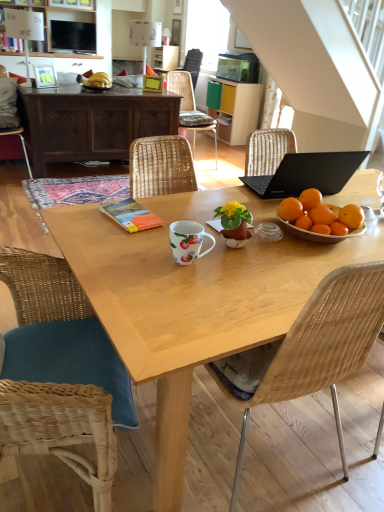
Measure the distance between wooden wicker chair at lower left, which is counted as the 2th chair, starting from the back, and camera.

wooden wicker chair at lower left, which is counted as the 2th chair, starting from the back, and camera are 12.10 feet apart from each other.

Describe the element at coordinates (11, 113) in the screenshot. I see `wooden wicker chair at lower left, which is counted as the 2th chair, starting from the back` at that location.

How much space does wooden picture frame at upper left, which ranks as the first picture frame in bottom-to-top order, occupy horizontally?

It is 4.42 inches.

How much space does dark wood cabinet at upper left, the first desk when ordered from top to bottom, occupy vertically?

It is 30.21 inches.

What do you see at coordinates (239, 109) in the screenshot? This screenshot has width=384, height=512. I see `matte wood cabinet at center, the first cabinetry in the bottom-to-top sequence` at bounding box center [239, 109].

The image size is (384, 512). Find the location of `wooden wicker chair at lower left, marked as the 1th chair in a left-to-right arrangement`. wooden wicker chair at lower left, marked as the 1th chair in a left-to-right arrangement is located at coordinates (11, 113).

Can you tell me how much wooden picture frame at upper left, which ranks as the first picture frame in bottom-to-top order, and matte wood cabinet at upper left, the first cabinetry from the left, differ in facing direction?

The facing directions of wooden picture frame at upper left, which ranks as the first picture frame in bottom-to-top order, and matte wood cabinet at upper left, the first cabinetry from the left, are 35.6 degrees apart.

From the image's perspective, is wooden picture frame at upper left, placed as the fourth picture frame when sorted from right to left, under matte wood cabinet at upper left, acting as the first cabinetry starting from the top?

Yes, from the image's perspective, wooden picture frame at upper left, placed as the fourth picture frame when sorted from right to left, is below matte wood cabinet at upper left, acting as the first cabinetry starting from the top.

Visually, is wooden picture frame at upper left, marked as the first picture frame in a front-to-back arrangement, positioned to the left or to the right of matte wood cabinet at upper left, the 2th cabinetry from the right?

Clearly, wooden picture frame at upper left, marked as the first picture frame in a front-to-back arrangement, is on the right of matte wood cabinet at upper left, the 2th cabinetry from the right, in the image.

Is wooden picture frame at upper left, the fourth picture frame from the top, completely or partially outside of matte wood cabinet at upper left, the first cabinetry from the left?

Yes.

Which is more to the left, wooden picture frame at upper center, arranged as the 2th picture frame when viewed from the back, or wooden woven chair at center, acting as the first chair starting from the back?

From the viewer's perspective, wooden picture frame at upper center, arranged as the 2th picture frame when viewed from the back, appears more on the left side.

Can you confirm if wooden picture frame at upper center, arranged as the 2th picture frame when viewed from the back, is smaller than wooden woven chair at center, which appears as the second chair when viewed from the right?

Correct, wooden picture frame at upper center, arranged as the 2th picture frame when viewed from the back, occupies less space than wooden woven chair at center, which appears as the second chair when viewed from the right.

From a real-world perspective, between wooden picture frame at upper center, the 4th picture frame viewed from the left, and wooden woven chair at center, which appears as the second chair when viewed from the right, who is vertically higher?

From a 3D spatial view, wooden picture frame at upper center, the 4th picture frame viewed from the left, is above.

Is wooden table at center, acting as the 1th desk starting from the bottom, situated inside matte black tv at upper left or outside?

wooden table at center, acting as the 1th desk starting from the bottom, cannot be found inside matte black tv at upper left.

Which is more to the left, wooden table at center, positioned as the 1th desk in front-to-back order, or matte black tv at upper left?

Positioned to the left is matte black tv at upper left.

Considering the sizes of wooden table at center, positioned as the 1th desk in front-to-back order, and matte black tv at upper left in the image, is wooden table at center, positioned as the 1th desk in front-to-back order, taller or shorter than matte black tv at upper left?

Considering their sizes, wooden table at center, positioned as the 1th desk in front-to-back order, has more height than matte black tv at upper left.

Could you tell me if wooden table at center, acting as the 2th desk starting from the top, is facing matte black tv at upper left?

Yes, wooden table at center, acting as the 2th desk starting from the top, is aimed at matte black tv at upper left.

Does point (146, 75) come closer to viewer compared to point (238, 85)?

Yes, it is in front of point (238, 85).

From a real-world perspective, between matte gold picture frame at center, arranged as the third picture frame when viewed from the right, and matte wood cabinet at center, the 2th cabinetry from the left, who is vertically higher?

matte gold picture frame at center, arranged as the third picture frame when viewed from the right.

Considering the positions of objects matte gold picture frame at center, the 2th picture frame when ordered from front to back, and matte wood cabinet at center, the 2th cabinetry positioned from the top, in the image provided, who is in front, matte gold picture frame at center, the 2th picture frame when ordered from front to back, or matte wood cabinet at center, the 2th cabinetry positioned from the top,?

Positioned in front is matte gold picture frame at center, the 2th picture frame when ordered from front to back.

Considering the relative sizes of matte gold picture frame at center, which appears as the second picture frame when viewed from the left, and matte wood cabinet at center, the first cabinetry in the bottom-to-top sequence, in the image provided, is matte gold picture frame at center, which appears as the second picture frame when viewed from the left, shorter than matte wood cabinet at center, the first cabinetry in the bottom-to-top sequence,?

Correct, matte gold picture frame at center, which appears as the second picture frame when viewed from the left, is not as tall as matte wood cabinet at center, the first cabinetry in the bottom-to-top sequence.

Who is shorter, wooden wicker chair at lower left, placed as the 3th chair when sorted from front to back, or wooden woven chair at center, acting as the first chair starting from the back?

wooden woven chair at center, acting as the first chair starting from the back, is shorter.

Does point (12, 135) come in front of point (192, 91)?

Yes, it is.

Is wooden wicker chair at lower left, marked as the fourth chair in a right-to-left arrangement, wider or thinner than wooden woven chair at center, which appears as the second chair when viewed from the right?

Considering their sizes, wooden wicker chair at lower left, marked as the fourth chair in a right-to-left arrangement, looks broader than wooden woven chair at center, which appears as the second chair when viewed from the right.

Is wooden wicker chair at lower left, which is counted as the 2th chair, starting from the back, in contact with wooden woven chair at center, acting as the fourth chair starting from the front?

wooden wicker chair at lower left, which is counted as the 2th chair, starting from the back, is not next to wooden woven chair at center, acting as the fourth chair starting from the front, and they're not touching.

Who is taller, wooden wicker chair at lower left, which is counted as the 2th chair, starting from the back, or matte gold picture frame at center, the second picture frame from the bottom?

Standing taller between the two is wooden wicker chair at lower left, which is counted as the 2th chair, starting from the back.

Is wooden wicker chair at lower left, which is counted as the 2th chair, starting from the back, not within matte gold picture frame at center, which ranks as the third picture frame in back-to-front order?

Absolutely, wooden wicker chair at lower left, which is counted as the 2th chair, starting from the back, is external to matte gold picture frame at center, which ranks as the third picture frame in back-to-front order.

How far apart are wooden wicker chair at lower left, marked as the fourth chair in a right-to-left arrangement, and matte gold picture frame at center, which appears as the second picture frame when viewed from the left?

The distance of wooden wicker chair at lower left, marked as the fourth chair in a right-to-left arrangement, from matte gold picture frame at center, which appears as the second picture frame when viewed from the left, is 4.32 feet.

From a real-world perspective, is dark wood cabinet at upper left, which is counted as the second desk, starting from the front, physically located above or below woven wood chair at lower left, marked as the second chair in a left-to-right arrangement?

dark wood cabinet at upper left, which is counted as the second desk, starting from the front, is situated higher than woven wood chair at lower left, marked as the second chair in a left-to-right arrangement, in the real world.

Which object is closer to the camera, dark wood cabinet at upper left, marked as the first desk in a back-to-front arrangement, or woven wood chair at lower left, the 1th chair from the front?

Result: woven wood chair at lower left, the 1th chair from the front, is closer to the camera.

Is the surface of dark wood cabinet at upper left, which is counted as the second desk, starting from the front, in direct contact with woven wood chair at lower left, which is the 4th chair in back-to-front order?

No, dark wood cabinet at upper left, which is counted as the second desk, starting from the front, is not with woven wood chair at lower left, which is the 4th chair in back-to-front order.

Is dark wood cabinet at upper left, which is counted as the second desk, starting from the front, to the right of woven wood chair at lower left, the 1th chair from the front, from the viewer's perspective?

No, dark wood cabinet at upper left, which is counted as the second desk, starting from the front, is not to the right of woven wood chair at lower left, the 1th chair from the front.

Find the location of `cabinetry on the left of wooden picture frame at upper left, which is the first picture frame from left to right`. cabinetry on the left of wooden picture frame at upper left, which is the first picture frame from left to right is located at coordinates (63, 23).

At what (x,y) coordinates should I click in order to perform the action: click on chair that is the 1st one when counting rightward from the wooden picture frame at upper center, the 4th picture frame viewed from the left. Please return your answer as a coordinate pair (x, y). The height and width of the screenshot is (512, 384). Looking at the image, I should click on (182, 89).

Estimate the real-world distances between objects in this image. Which object is closer to porcelain floral mug at center, orange matte book at center or dark wood cabinet at upper left, the 2th desk positioned from the bottom?

orange matte book at center lies closer to porcelain floral mug at center than the other object.

When comparing their distances from white plastic lamp at upper center, does wooden woven chair at center, which appears as the second chair when viewed from the right, or matte black tv at upper left seem further?

Based on the image, matte black tv at upper left appears to be further to white plastic lamp at upper center.

When comparing their distances from wooden picture frame at upper center, which ranks as the 1th picture frame in back-to-front order, does woven wood chair at center, the 1th chair when ordered from right to left, or porcelain floral mug at center seem closer?

porcelain floral mug at center lies closer to wooden picture frame at upper center, which ranks as the 1th picture frame in back-to-front order, than the other object.

Estimate the real-world distances between objects in this image. Which object is further from matte wood cabinet at upper left, the first cabinetry from the left, porcelain floral mug at center or woven wood chair at lower left, which appears as the 3th chair when viewed from the right?

The object further to matte wood cabinet at upper left, the first cabinetry from the left, is porcelain floral mug at center.

Based on their spatial positions, is wooden picture frame at upper center, which is the 2th picture frame in top-to-bottom order, or dark wood cabinet at upper left, which is counted as the second desk, starting from the front, further from matte wood cabinet at upper left, the first cabinetry from the left?

Among the two, wooden picture frame at upper center, which is the 2th picture frame in top-to-bottom order, is located further to matte wood cabinet at upper left, the first cabinetry from the left.

Which object lies further to the anchor point orange matte book at center, white plastic lamp at upper center or matte wood cabinet at upper left, acting as the first cabinetry starting from the top?

white plastic lamp at upper center is further to orange matte book at center.

From the picture: Considering their positions, is porcelain floral mug at center positioned closer to dark wood cabinet at upper left, the 2th desk positioned from the bottom, than wooden woven chair at center, acting as the first chair starting from the back?

The object closer to dark wood cabinet at upper left, the 2th desk positioned from the bottom, is wooden woven chair at center, acting as the first chair starting from the back.

When comparing their distances from woven wood chair at center, positioned as the fourth chair in left-to-right order, does wooden wicker chair at lower left, marked as the 1th chair in a left-to-right arrangement, or wooden picture frame at upper left, placed as the fourth picture frame when sorted from right to left, seem closer?

Based on the image, wooden wicker chair at lower left, marked as the 1th chair in a left-to-right arrangement, appears to be nearer to woven wood chair at center, positioned as the fourth chair in left-to-right order.

You are a GUI agent. You are given a task and a screenshot of the screen. Output one action in this format:
    pyautogui.click(x=<x>, y=<y>)
    Task: Click on the television between matte wood cabinet at upper left, the first cabinetry from the left, and matte wood cabinet at center, the 1th cabinetry when ordered from right to left
    
    Given the screenshot: What is the action you would take?
    pyautogui.click(x=73, y=37)

At what (x,y) coordinates should I click in order to perform the action: click on desk located between orange matte book at center and wooden woven chair at center, acting as the fourth chair starting from the front, in the depth direction. Please return your answer as a coordinate pair (x, y). Looking at the image, I should click on (91, 122).

Where is `chair located between wooden picture frame at upper left, the fourth picture frame from the top, and wooden picture frame at upper center, which is counted as the 4th picture frame, starting from the front, in the depth direction`? chair located between wooden picture frame at upper left, the fourth picture frame from the top, and wooden picture frame at upper center, which is counted as the 4th picture frame, starting from the front, in the depth direction is located at coordinates (182, 89).

At what (x,y) coordinates should I click in order to perform the action: click on desk positioned between porcelain floral mug at center and matte gold picture frame at center, the third picture frame viewed from the top, from near to far. Please return your answer as a coordinate pair (x, y). Looking at the image, I should click on (91, 122).